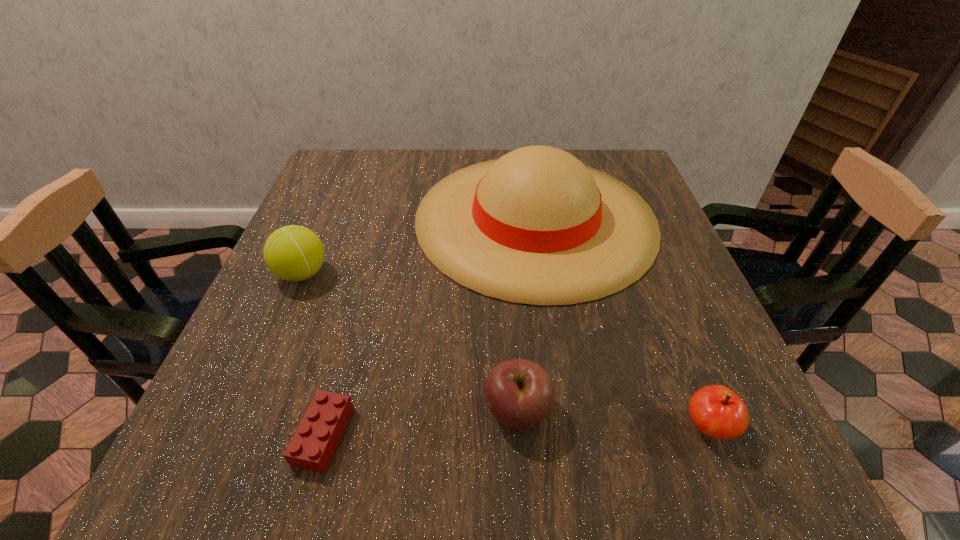
This screenshot has height=540, width=960. In order to click on vacant space that satisfies the following two spatial constraints: 1. on the side of the left apple with the unique marking; 2. on the front side of the Lego in this screenshot , I will do `click(518, 435)`.

Identify the location of vacant space that satisfies the following two spatial constraints: 1. on the front side of the sombrero; 2. on the side of the left apple with the unique marking. (564, 411).

Image resolution: width=960 pixels, height=540 pixels. I want to click on free region that satisfies the following two spatial constraints: 1. on the front side of the right apple; 2. on the right side of the leftmost object, so [238, 427].